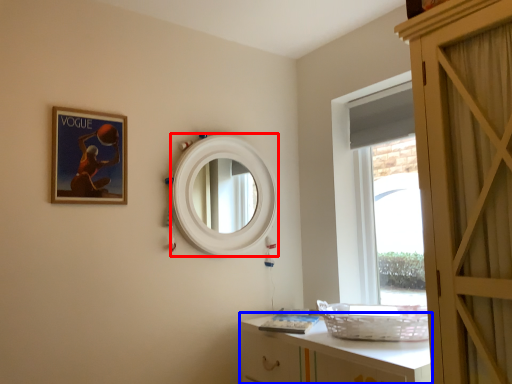
Question: Which object is closer to the camera taking this photo, mirror (highlighted by a red box) or cabinetry (highlighted by a blue box)?

Choices:
 (A) mirror
 (B) cabinetry

Answer: (B)